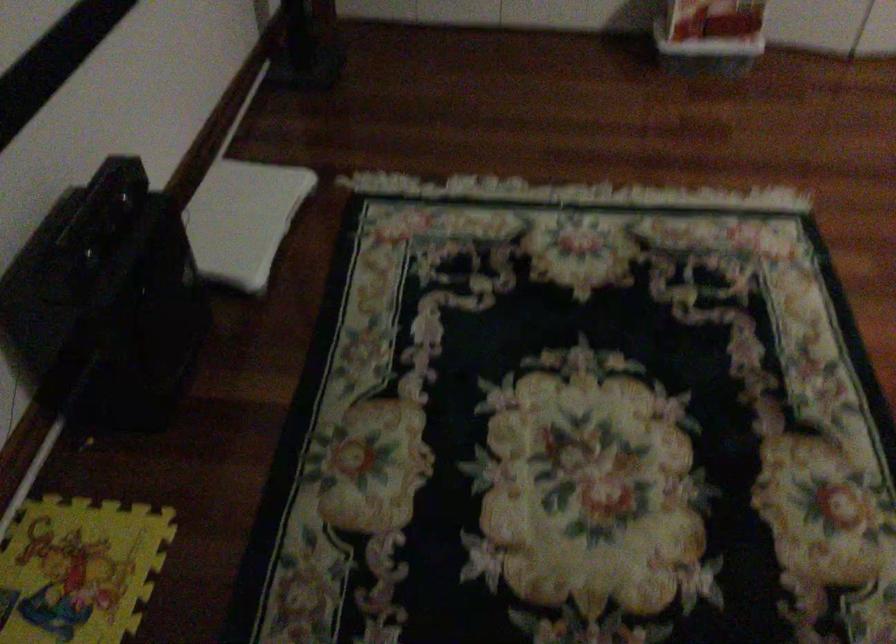
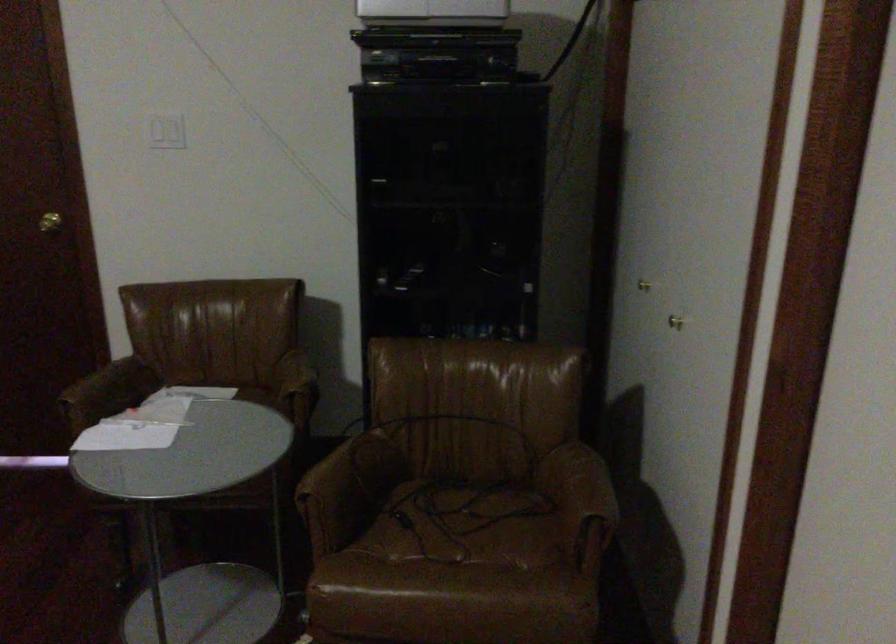
Based on the continuous images, in which direction is the camera rotating?

The camera's rotation is toward right-down.